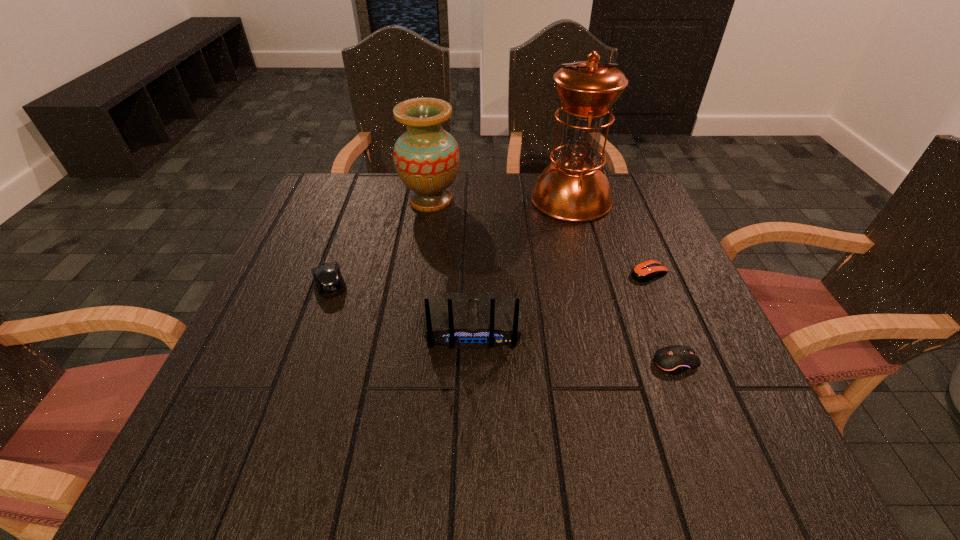
Locate an element on the screen. The width and height of the screenshot is (960, 540). blank area in the image that satisfies the following two spatial constraints: 1. on the back side of the nearest computer mouse; 2. on the left side of the shortest object is located at coordinates (639, 273).